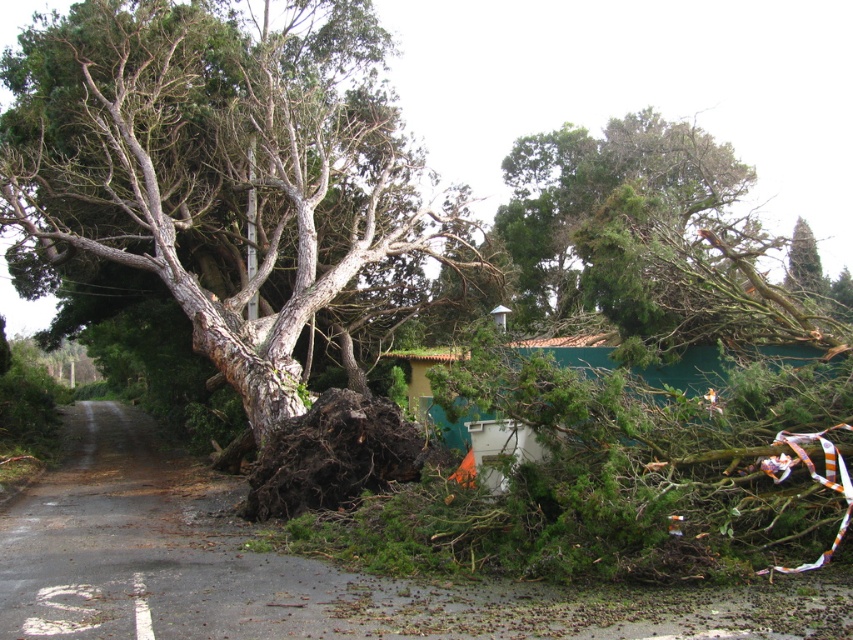
You are a drone operator trying to assess the damage from above. You see the brown rough bark tree at center represented by point (224,170). Can you confirm if this point is located on the tree?

Yes, the brown rough bark tree at center is represented by point (224,170), so the point is indeed located on the tree.

You are a rescue worker trying to reach the house behind the fallen trees. You see the brown rough bark tree at center and the green rough bark tree at upper right. Which tree is closer to the left side of your view?

The brown rough bark tree at center is to the left of the green rough bark tree at upper right, so it is closer to the left side of your view.